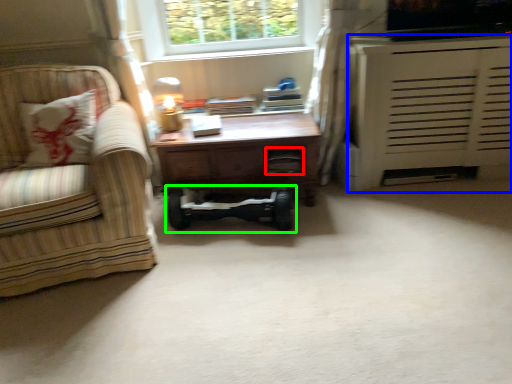
Question: Which object is the farthest from drawer (highlighted by a red box)? Choose among these: cabinetry (highlighted by a blue box) or baby carriage (highlighted by a green box).

Choices:
 (A) cabinetry
 (B) baby carriage

Answer: (A)